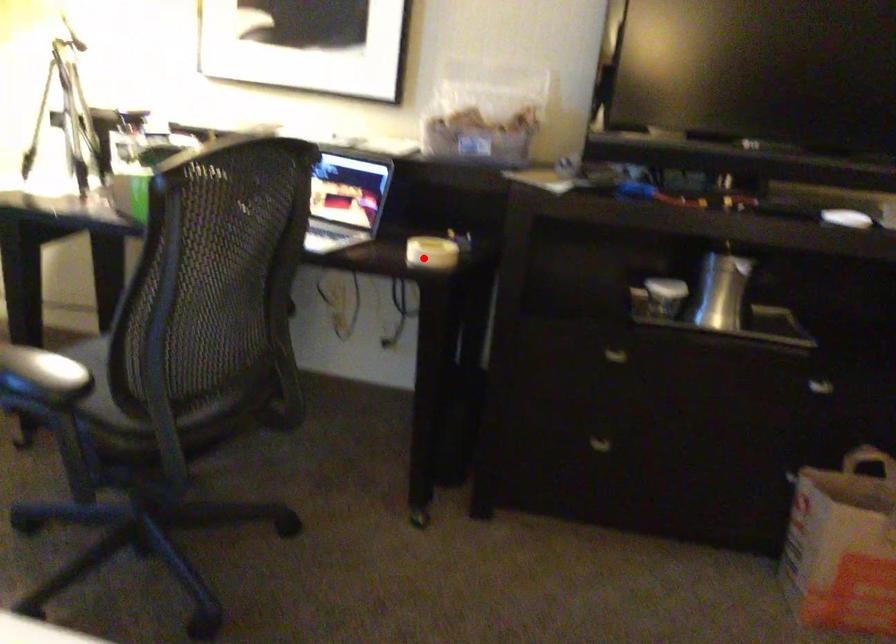
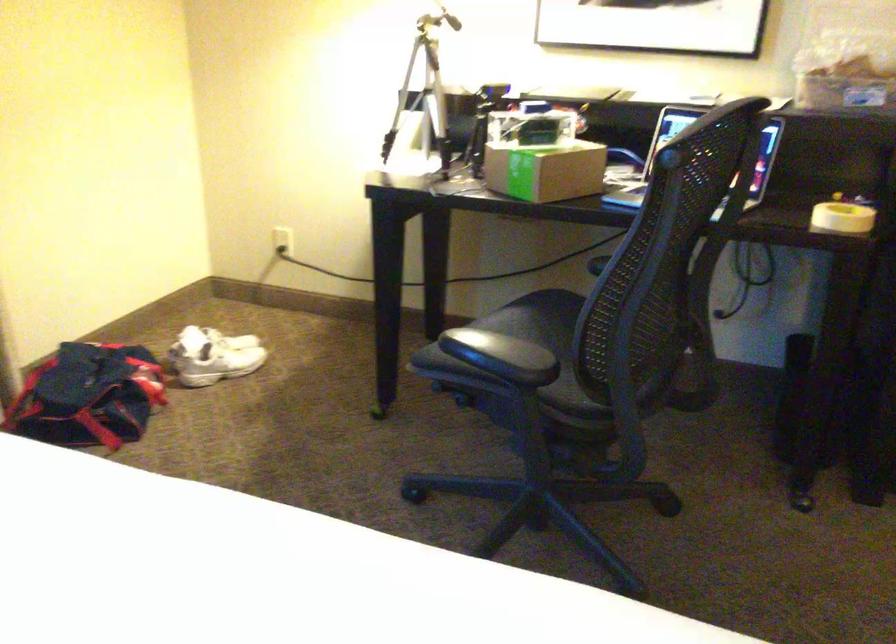
Question: I am providing you with two images of the same scene from different viewpoints. Image1 has a red point marked. In image2, the corresponding 3D location appears at what relative position? Reply with the corresponding letter.

Choices:
 (A) Closer
 (B) Farther

Answer: (A)